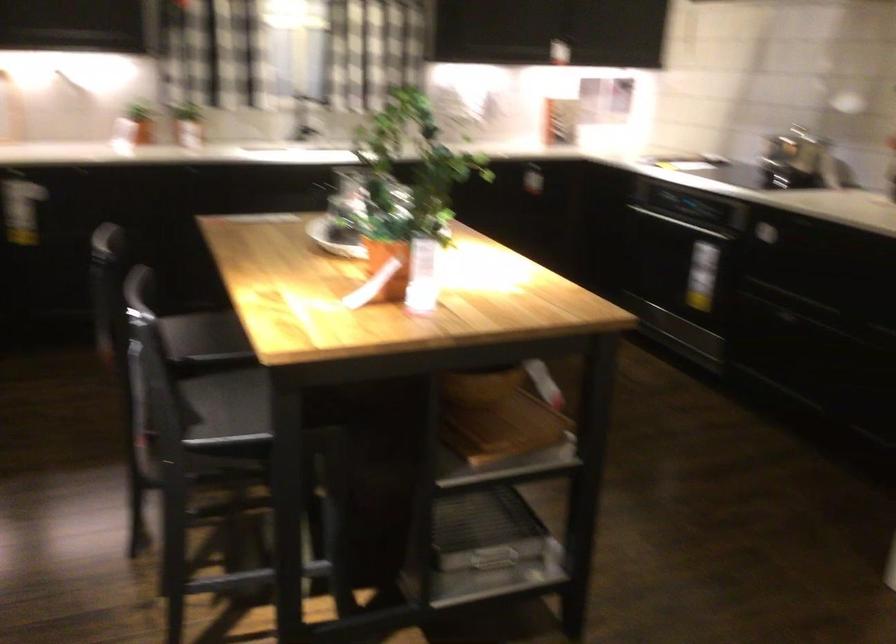
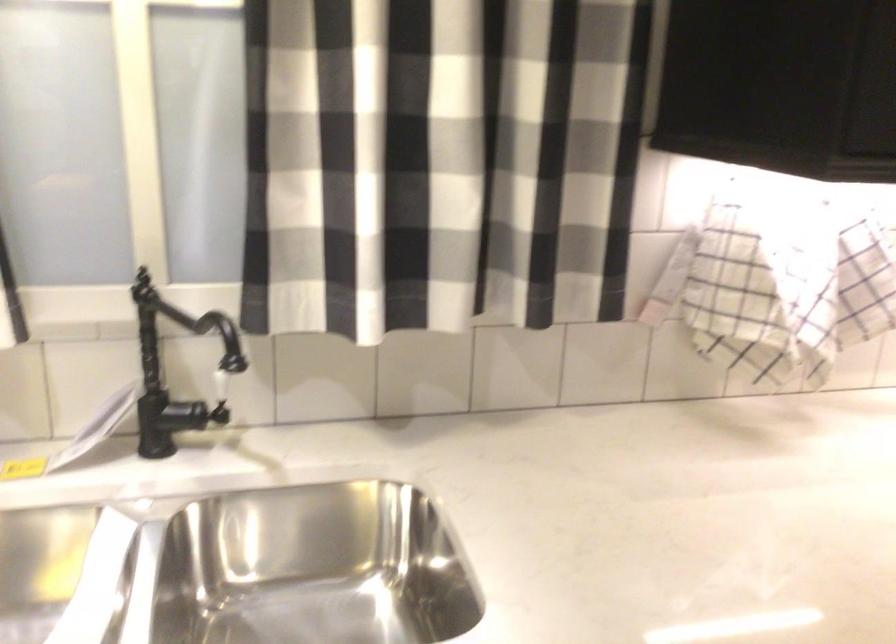
Question: The images are taken continuously from a first-person perspective. In which direction are you moving?

Choices:
 (A) Left
 (B) Right
 (C) Forward
 (D) Backward

Answer: (C)